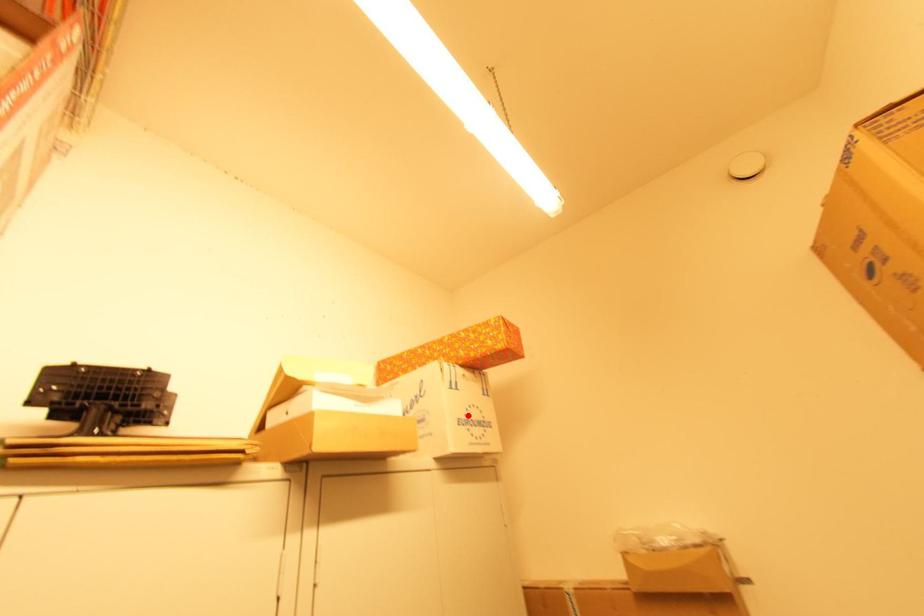
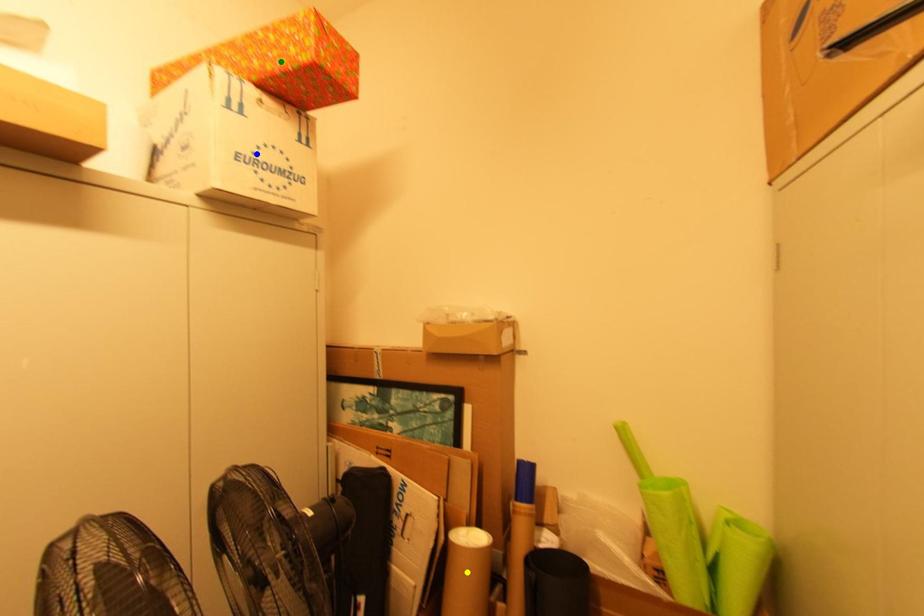
Question: I am providing you with two images of the same scene from different viewpoints. A red point is marked on the first image. You are given multiple points on the second image. In image 2, which mark is for the same physical point as the one in image 1?

Choices:
 (A) green point
 (B) blue point
 (C) yellow point

Answer: (B)